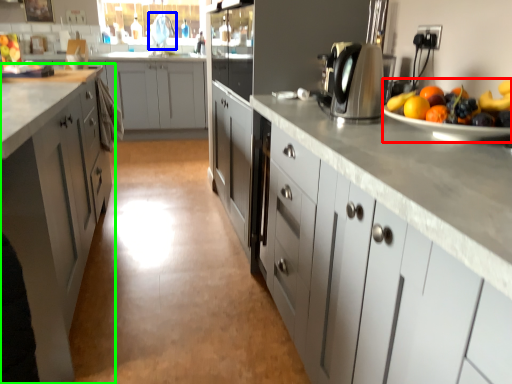
Question: Which object is positioned farthest from fruit salad (highlighted by a red box)? Select from faucet (highlighted by a blue box) and cabinetry (highlighted by a green box).

Choices:
 (A) faucet
 (B) cabinetry

Answer: (A)